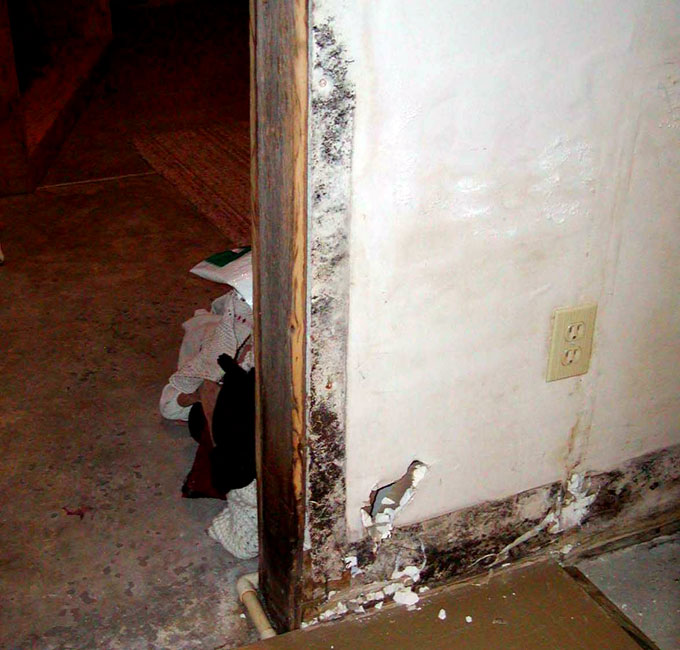
The width and height of the screenshot is (680, 650). Identify the location of outlet holes. (568, 331), (579, 327), (575, 337), (566, 353), (576, 353), (568, 359).